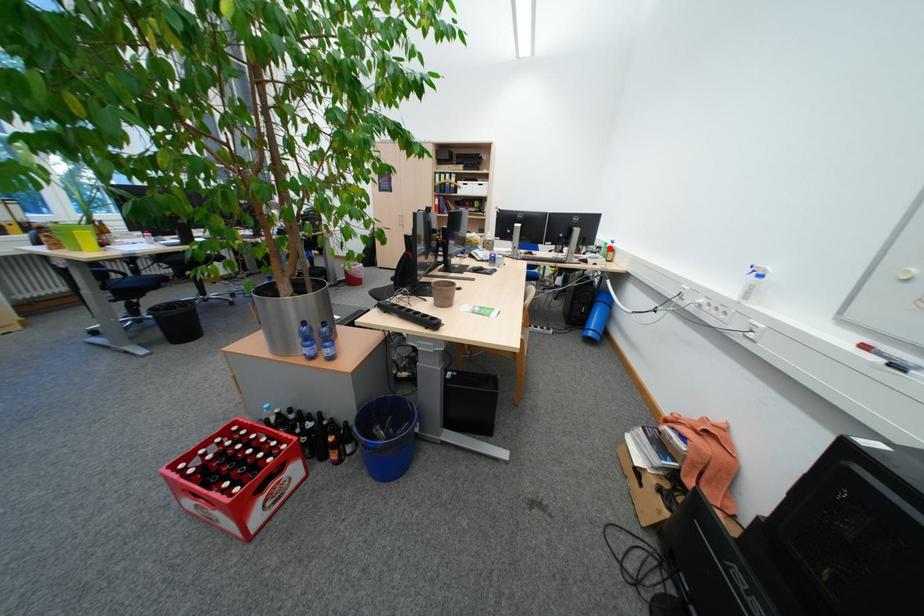
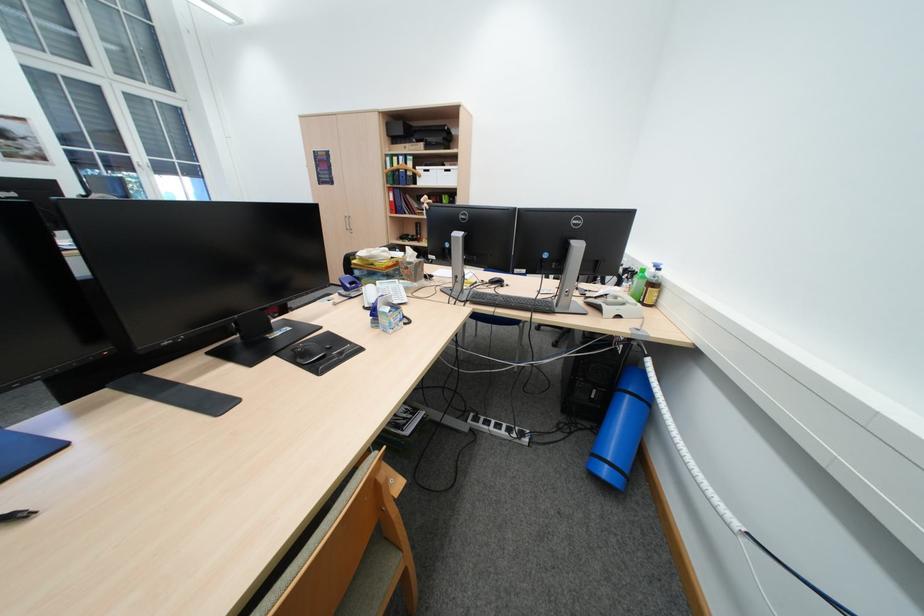
Where in the second image is the point corresponding to the highlighted location from the first image?

(638, 272)